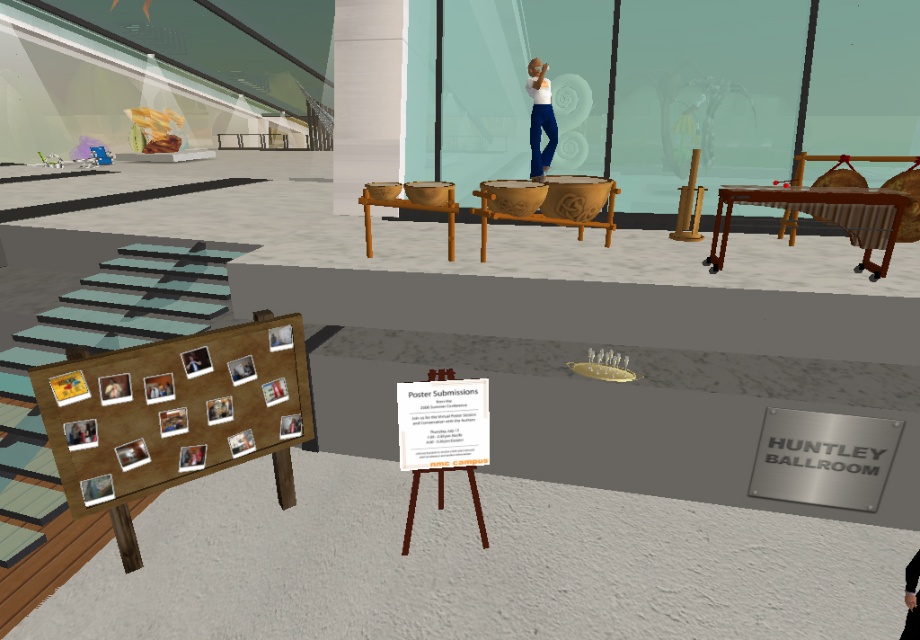
You are standing in the Huntley Ballroom and need to locate the wooden board at lower left and the wooden carved drums at center. From your current position, which object is positioned to the left?

The wooden board at lower left is positioned to the left of the wooden carved drums at center, so the wooden board at lower left is the one to the left.

You are organizing a small concert in the Huntley Ballroom and need to place a 1.5 meter wide stage between the wooden marimba at center and the dark gray sweater at center. Can the stage fit between them?

The wooden marimba at center might be wider than the dark gray sweater at center, so the stage might not fit between them if the distance between them is less than 1.5 meters. Check the actual distance to confirm.